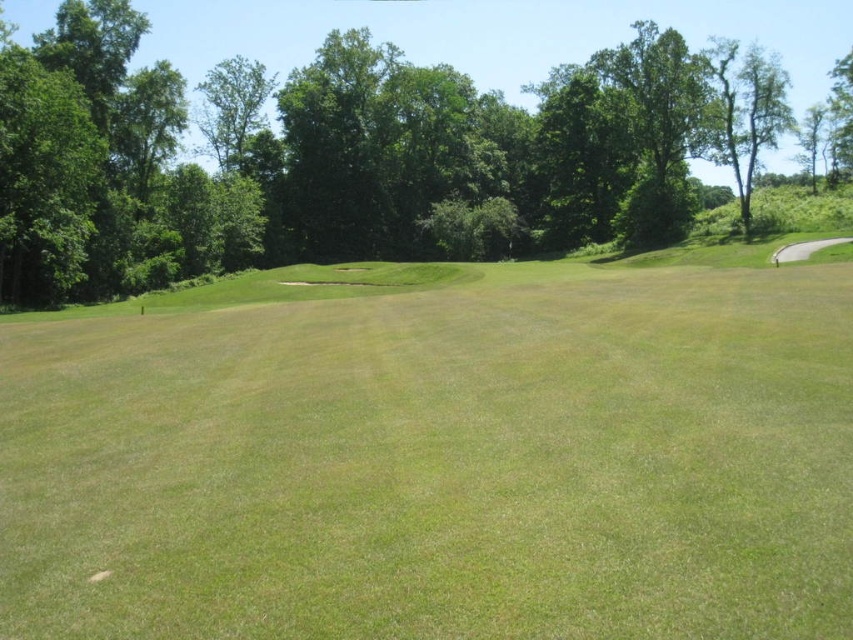
Can you confirm if green grassy field at center is thinner than green leafy tree at center?

Yes, green grassy field at center is thinner than green leafy tree at center.

Between green grassy field at center and green leafy tree at center, which one has more height?

green leafy tree at center

At what (x,y) coordinates should I click in order to perform the action: click on green grassy field at center. Please return your answer as a coordinate pair (x, y). The image size is (853, 640). Looking at the image, I should click on (440, 464).